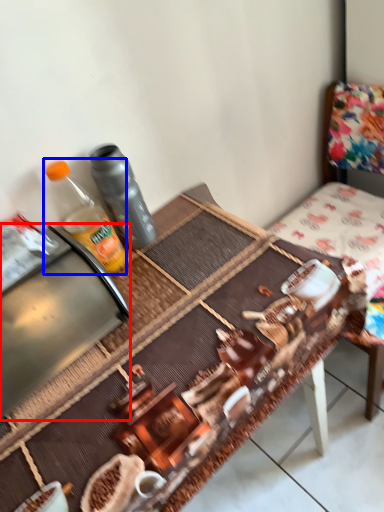
Question: Which point is further to the camera, appliance (highlighted by a red box) or bottle (highlighted by a blue box)?

Choices:
 (A) appliance
 (B) bottle

Answer: (B)